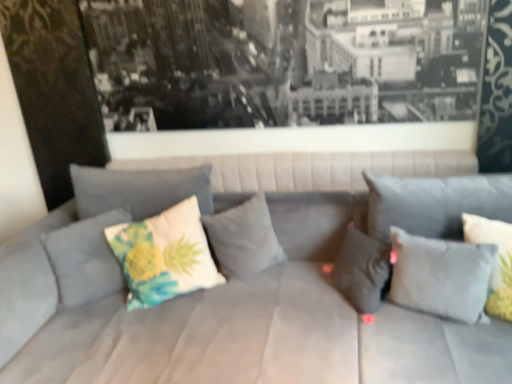
Question: Is suede gray couch at center inside or outside of gray fabric pillow at center, positioned as the fourth pillow in right-to-left order?

Choices:
 (A) outside
 (B) inside

Answer: (A)

Question: Is suede gray couch at center bigger or smaller than gray fabric pillow at center, which is the 3th pillow from left to right?

Choices:
 (A) big
 (B) small

Answer: (A)

Question: Estimate the real-world distances between objects in this image. Which object is closer to the gray fabric pillow at center, marked as the 3th pillow in a right-to-left arrangement?

Choices:
 (A) white fabric pillow at right, the 6th pillow positioned from the left
 (B) floral fabric pillow at center, which appears as the first pillow when viewed from the left
 (C) white matte pillow at right, which is the fifth pillow in left-to-right order
 (D) suede gray couch at center
 (E) white fabric pillow with pineapple print at center, the 5th pillow from the right

Answer: (C)

Question: Based on their relative distances, which object is farther from the gray fabric pillow at center, marked as the fourth pillow in a left-to-right arrangement?

Choices:
 (A) white matte pillow at right, which is counted as the 2th pillow, starting from the right
 (B) floral fabric pillow at center, which appears as the first pillow when viewed from the left
 (C) white fabric pillow at right, arranged as the first pillow when viewed from the right
 (D) suede gray couch at center
 (E) white fabric pillow with pineapple print at center, which is the 2th pillow from left to right

Answer: (B)